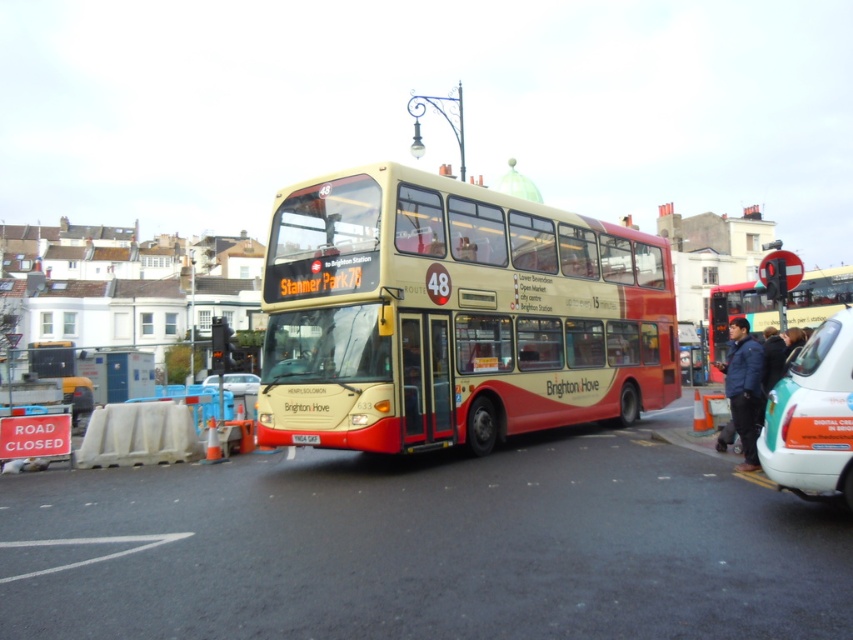
Question: Based on their relative distances, which object is nearer to the teal matte taxi at lower right?

Choices:
 (A) white plastic license plate at center
 (B) metallic silver car at center
 (C) red matte bus at right

Answer: (A)

Question: Does teal matte taxi at lower right appear on the right side of metallic silver car at center?

Choices:
 (A) no
 (B) yes

Answer: (B)

Question: Does metallic silver car at center lie in front of white plastic license plate at center?

Choices:
 (A) yes
 (B) no

Answer: (B)

Question: Which is farther from the matte gold bus at center?

Choices:
 (A) teal matte taxi at lower right
 (B) metallic silver car at center
 (C) red matte bus at right
 (D) white plastic license plate at center

Answer: (B)

Question: Is the position of matte gold bus at center less distant than that of white plastic license plate at center?

Choices:
 (A) yes
 (B) no

Answer: (A)

Question: Which point is closer to the camera?

Choices:
 (A) (759, 301)
 (B) (492, 412)
 (C) (312, 440)
 (D) (840, 374)

Answer: (D)